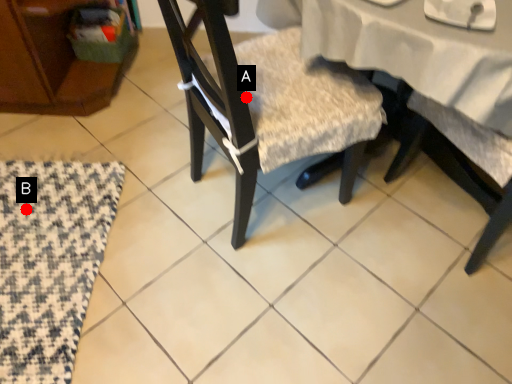
Question: Two points are circled on the image, labeled by A and B beside each circle. Which point appears closest to the camera in this image?

Choices:
 (A) A is closer
 (B) B is closer

Answer: (A)